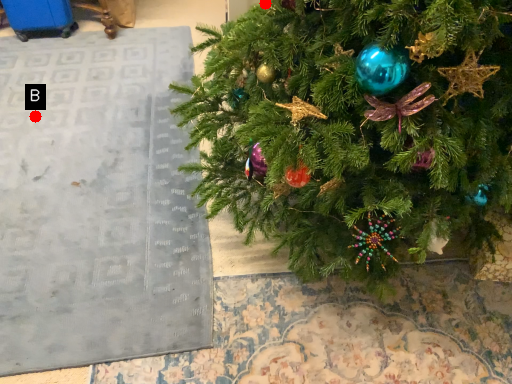
Question: Two points are circled on the image, labeled by A and B beside each circle. Which point is further to the camera?

Choices:
 (A) A is further
 (B) B is further

Answer: (B)